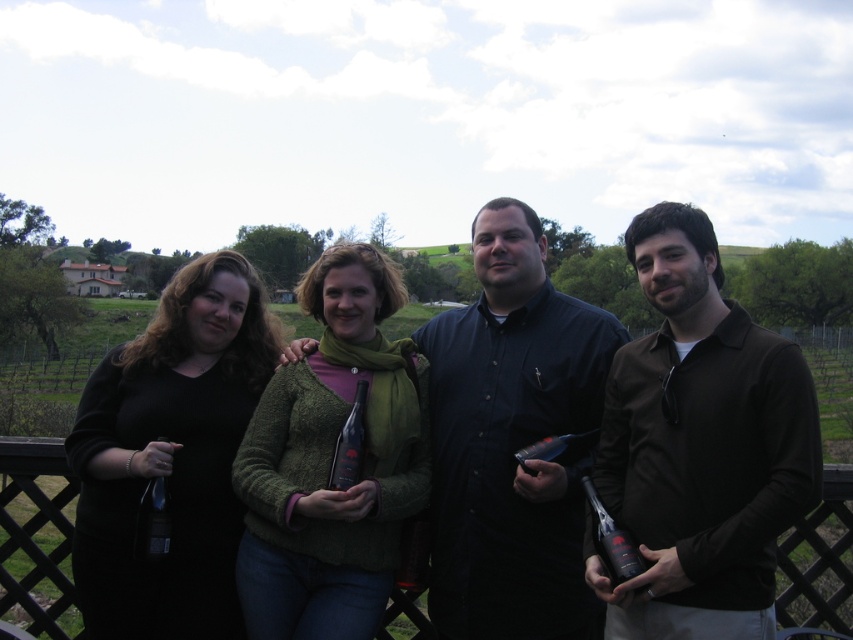
You are standing in front of the wooden deck where the group is standing. You notice two points marked on the deck at coordinates point (450, 376) and point (193, 355). If you want to place a small plant pot between them, which point should you place it closer to so that the pot is closer to the camera?

You should place the small plant pot closer to point (193, 355) because point (450, 376) is further away from the camera than point (193, 355). This way, the pot will be nearer to the camera.